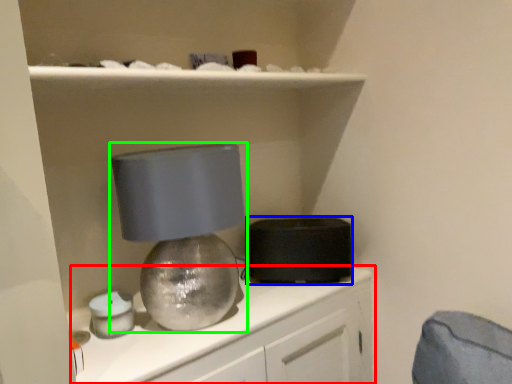
Question: Which object is the farthest from cabinetry (highlighted by a red box)? Choose among these: appliance (highlighted by a blue box) or lamp (highlighted by a green box).

Choices:
 (A) appliance
 (B) lamp

Answer: (B)